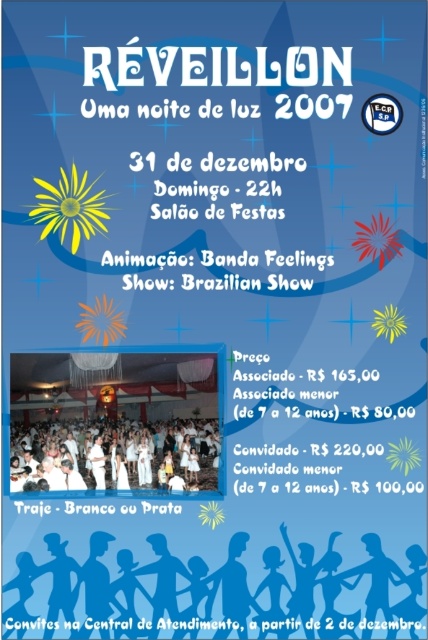
Question: Is silhouette paper people at lower center to the left of white cloth dress at center from the viewer's perspective?

Choices:
 (A) yes
 (B) no

Answer: (B)

Question: Can you confirm if silhouette paper people at lower center is positioned above white cloth dress at center?

Choices:
 (A) no
 (B) yes

Answer: (A)

Question: Which point is closer to the camera?

Choices:
 (A) (128, 476)
 (B) (329, 598)

Answer: (B)

Question: Among these points, which one is nearest to the camera?

Choices:
 (A) (50, 620)
 (B) (133, 481)

Answer: (A)

Question: Among these points, which one is farthest from the camera?

Choices:
 (A) (115, 614)
 (B) (169, 472)

Answer: (B)

Question: Can you confirm if silhouette paper people at lower center is wider than white cloth dress at center?

Choices:
 (A) no
 (B) yes

Answer: (B)